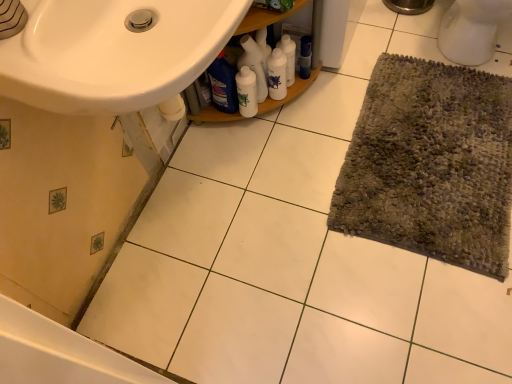
How much space does white glossy bottles at center, arranged as the 3th cleaning product when viewed from the left, occupy horizontally?

The width of white glossy bottles at center, arranged as the 3th cleaning product when viewed from the left, is 7.53 centimeters.

The image size is (512, 384). What do you see at coordinates (431, 164) in the screenshot?
I see `multicolored textured rug at right` at bounding box center [431, 164].

Measure the distance between point (x=236, y=72) and camera.

The depth of point (x=236, y=72) is 4.51 feet.

You are a GUI agent. You are given a task and a screenshot of the screen. Output one action in this format:
    pyautogui.click(x=<x>, y=<y>)
    Task: Click on the blue glossy bottle at center, positioned as the 4th cleaning product in right-to-left order
    This screenshot has width=512, height=384.
    Given the screenshot: What is the action you would take?
    pyautogui.click(x=223, y=84)

In order to face white glossy bottle at center, should I rotate leftwards or rightwards?

It's best to rotate left around 0.973 degrees.

This screenshot has width=512, height=384. Describe the element at coordinates (312, 64) in the screenshot. I see `white glossy bottles at center` at that location.

Identify the location of white glossy bottles at center, arranged as the 3th cleaning product when viewed from the left. This screenshot has height=384, width=512. (277, 74).

Can you confirm if white glossy bottle at center, which ranks as the 2th cleaning product in left-to-right order, is bigger than white glossy bottle at center?

Indeed, white glossy bottle at center, which ranks as the 2th cleaning product in left-to-right order, has a larger size compared to white glossy bottle at center.

How different are the orientations of white glossy bottle at center, which ranks as the 2th cleaning product in left-to-right order, and white glossy bottle at center in degrees?

They differ by 14.3 degrees in their facing directions.

Which is closer, (244, 48) or (243, 101)?

Point (244, 48) appears to be closer to the viewer than point (243, 101).

Considering the relative sizes of white glossy bottle at center, which ranks as the 2th cleaning product in left-to-right order, and white glossy bottle at center in the image provided, is white glossy bottle at center, which ranks as the 2th cleaning product in left-to-right order, wider than white glossy bottle at center?

Correct, the width of white glossy bottle at center, which ranks as the 2th cleaning product in left-to-right order, exceeds that of white glossy bottle at center.

Is the depth of white glossy bottle at center less than that of white glossy bottles at center, which is the second cleaning product from right to left?

Yes, white glossy bottle at center is closer to the camera.

How many degrees apart are the facing directions of white glossy bottle at center and white glossy bottles at center, arranged as the 3th cleaning product when viewed from the left?

The angle between the facing direction of white glossy bottle at center and the facing direction of white glossy bottles at center, arranged as the 3th cleaning product when viewed from the left, is 14.3 degrees.

The image size is (512, 384). Identify the location of the 2nd cleaning product directly beneath the white glossy bottle at center (from a real-world perspective). (277, 74).

Does white glossy bottle at center have a greater width compared to white glossy bottles at center, which is the second cleaning product from right to left?

No.

The image size is (512, 384). I want to click on cleaning product that is the 4th one when counting upward from the multicolored textured rug at right (from the image's perspective), so click(288, 57).

How many degrees apart are the facing directions of white glossy bottle at center, arranged as the 1th cleaning product when viewed from the right, and multicolored textured rug at right?

The angular difference between white glossy bottle at center, arranged as the 1th cleaning product when viewed from the right, and multicolored textured rug at right is 54.1 degrees.

Which of these two, white glossy bottle at center, the 4th cleaning product viewed from the left, or multicolored textured rug at right, is smaller?

With smaller size is white glossy bottle at center, the 4th cleaning product viewed from the left.

Does white glossy bottle at center, arranged as the 1th cleaning product when viewed from the right, turn towards multicolored textured rug at right?

No, white glossy bottle at center, arranged as the 1th cleaning product when viewed from the right, is not turned towards multicolored textured rug at right.

I want to click on cleaning product that is the 3rd object directly below the blue glossy bottle at center, positioned as the 4th cleaning product in right-to-left order (from a real-world perspective), so click(x=277, y=74).

In terms of size, does blue glossy bottle at center, positioned as the 4th cleaning product in right-to-left order, appear bigger or smaller than white glossy bottles at center, which is the second cleaning product from right to left?

blue glossy bottle at center, positioned as the 4th cleaning product in right-to-left order, is bigger than white glossy bottles at center, which is the second cleaning product from right to left.

Is blue glossy bottle at center, the 1th cleaning product positioned from the left, turned away from white glossy bottles at center, arranged as the 3th cleaning product when viewed from the left?

No, blue glossy bottle at center, the 1th cleaning product positioned from the left,'s orientation is not away from white glossy bottles at center, arranged as the 3th cleaning product when viewed from the left.

Is point (286, 56) positioned before point (137, 110)?

No, it is behind (137, 110).

From the image's perspective, relative to white glossy sink at upper left, is white glossy bottle at center, arranged as the 1th cleaning product when viewed from the right, above or below?

From the image's perspective, white glossy bottle at center, arranged as the 1th cleaning product when viewed from the right, appears above white glossy sink at upper left.

Based on their sizes in the image, would you say white glossy bottle at center, arranged as the 1th cleaning product when viewed from the right, is bigger or smaller than white glossy sink at upper left?

In the image, white glossy bottle at center, arranged as the 1th cleaning product when viewed from the right, appears to be smaller than white glossy sink at upper left.

Is white glossy bottle at center, arranged as the 1th cleaning product when viewed from the right, next to white glossy sink at upper left and touching it?

No.

Is white glossy bottles at center inside or outside of white glossy bottle at center, which ranks as the 3th cleaning product in right-to-left order?

The correct answer is: outside.

From the image's perspective, between white glossy bottles at center and white glossy bottle at center, which ranks as the 3th cleaning product in right-to-left order, which one is located above?

white glossy bottles at center appears higher in the image.

From a real-world perspective, who is located higher, white glossy bottles at center or white glossy bottle at center, which ranks as the 2th cleaning product in left-to-right order?

white glossy bottles at center.

Does white glossy bottles at center appear on the left side of white glossy bottle at center, which ranks as the 3th cleaning product in right-to-left order?

No, white glossy bottles at center is not to the left of white glossy bottle at center, which ranks as the 3th cleaning product in right-to-left order.

Is point (289, 76) more distant than point (290, 99)?

No, it is not.

Considering the relative positions of white glossy bottle at center, arranged as the 1th cleaning product when viewed from the right, and white glossy bottles at center in the image provided, is white glossy bottle at center, arranged as the 1th cleaning product when viewed from the right, to the right of white glossy bottles at center from the viewer's perspective?

Yes.

How different are the orientations of white glossy bottle at center, the 4th cleaning product viewed from the left, and white glossy bottles at center in degrees?

There is a 35.9-degree angle between the facing directions of white glossy bottle at center, the 4th cleaning product viewed from the left, and white glossy bottles at center.

Find the location of a particular element. This screenshot has height=384, width=512. cleaning product that is the 4th object located behind the white glossy bottles at center is located at coordinates (288, 57).

Find the location of a particular element. This screenshot has height=384, width=512. the 1st cleaning product in front of the white glossy bottle at center, starting your count from the anchor is located at coordinates (254, 65).

You are a GUI agent. You are given a task and a screenshot of the screen. Output one action in this format:
    pyautogui.click(x=<x>, y=<y>)
    Task: Click on the 2nd cleaning product to the right when counting from the white glossy bottle at center
    The width and height of the screenshot is (512, 384).
    Given the screenshot: What is the action you would take?
    pyautogui.click(x=277, y=74)

Considering their positions, is white glossy bottles at center positioned closer to white glossy bottles at center, which is the second cleaning product from right to left, than white glossy bottle at center?

white glossy bottle at center is closer to white glossy bottles at center, which is the second cleaning product from right to left.

From the image, which object appears to be farther from white glossy bottles at center, which is the second cleaning product from right to left, white glossy bottle at center or white glossy bottles at center?

Among the two, white glossy bottles at center is located further to white glossy bottles at center, which is the second cleaning product from right to left.

Which object lies further to the anchor point white glossy bottle at center, the 4th cleaning product viewed from the left, white glossy bottle at center or blue glossy bottle at center, the 1th cleaning product positioned from the left?

blue glossy bottle at center, the 1th cleaning product positioned from the left, is further to white glossy bottle at center, the 4th cleaning product viewed from the left.

From the image, which object appears to be farther from white glossy bottle at center, blue glossy bottle at center, positioned as the 4th cleaning product in right-to-left order, or white glossy bottle at center, arranged as the 1th cleaning product when viewed from the right?

white glossy bottle at center, arranged as the 1th cleaning product when viewed from the right, is further to white glossy bottle at center.

From the image, which object appears to be farther from multicolored textured rug at right, white glossy bottles at center or white glossy bottle at center?

white glossy bottle at center.

From the image, which object appears to be nearer to white glossy bottle at center, the 4th cleaning product viewed from the left, multicolored textured rug at right or white glossy bottles at center?

Based on the image, white glossy bottles at center appears to be nearer to white glossy bottle at center, the 4th cleaning product viewed from the left.

When comparing their distances from blue glossy bottle at center, positioned as the 4th cleaning product in right-to-left order, does white glossy bottle at center, the 4th cleaning product viewed from the left, or white glossy bottles at center seem further?

white glossy bottle at center, the 4th cleaning product viewed from the left, is further to blue glossy bottle at center, positioned as the 4th cleaning product in right-to-left order.

From the image, which object appears to be nearer to white glossy bottle at center, the 4th cleaning product viewed from the left, white glossy bottles at center or white glossy bottles at center, arranged as the 3th cleaning product when viewed from the left?

Among the two, white glossy bottles at center, arranged as the 3th cleaning product when viewed from the left, is located nearer to white glossy bottle at center, the 4th cleaning product viewed from the left.

The image size is (512, 384). Identify the location of cleaning product between white glossy sink at upper left and white glossy bottle at center, which ranks as the 2th cleaning product in left-to-right order, in the front-back direction. (223, 84).

The image size is (512, 384). I want to click on cleaning product located between white glossy bottle at center, which ranks as the 3th cleaning product in right-to-left order, and white glossy bottle at center, arranged as the 1th cleaning product when viewed from the right, in the left-right direction, so click(277, 74).

In order to click on balustrade located between white glossy sink at upper left and blue glossy bottle at center, the 1th cleaning product positioned from the left, in the depth direction in this screenshot , I will do `click(312, 64)`.

Identify the location of cleaning product situated between white glossy bottles at center, arranged as the 3th cleaning product when viewed from the left, and multicolored textured rug at right from left to right. (288, 57).